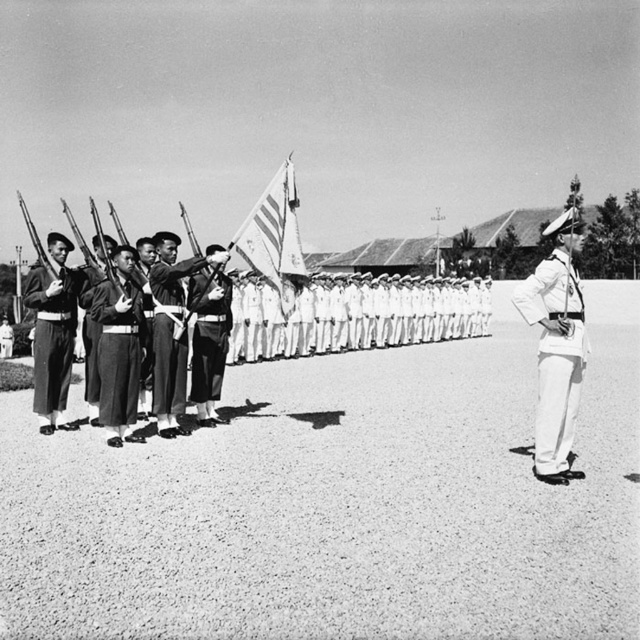
What do you see at coordinates (170, 330) in the screenshot?
I see `uniformed soldier at center` at bounding box center [170, 330].

Is uniformed soldier at center above dark gray fabric uniform at left?

Yes, uniformed soldier at center is above dark gray fabric uniform at left.

Locate an element on the screen. uniformed soldier at center is located at coordinates (170, 330).

Consider the image. Does white cotton uniform at right have a larger size compared to dark gray woolen jacket at center?

Indeed, white cotton uniform at right has a larger size compared to dark gray woolen jacket at center.

Find the location of a particular element. white cotton uniform at right is located at coordinates (556, 355).

Locate an element on the screen. The height and width of the screenshot is (640, 640). white cotton uniform at right is located at coordinates (556, 355).

Which is below, uniformed soldier at center or smooth dark uniform at center?

Positioned lower is uniformed soldier at center.

Is uniformed soldier at center wider than smooth dark uniform at center?

Correct, the width of uniformed soldier at center exceeds that of smooth dark uniform at center.

Which is behind, point (168, 346) or point (205, 310)?

Point (205, 310)

The height and width of the screenshot is (640, 640). I want to click on uniformed soldier at center, so click(x=170, y=330).